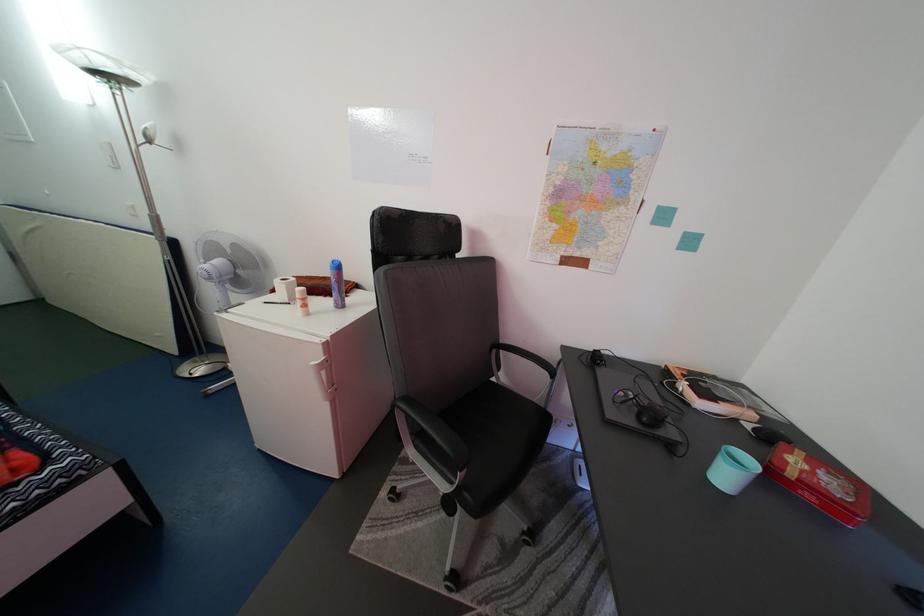
Locate an element on the screen. This screenshot has width=924, height=616. blue aerosol can is located at coordinates (336, 284).